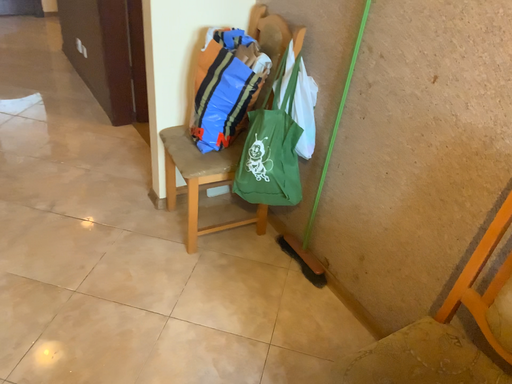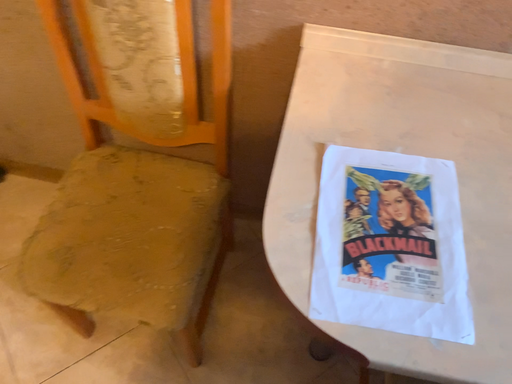
Question: Which way did the camera rotate in the video?

Choices:
 (A) rotated upward
 (B) rotated downward

Answer: (B)